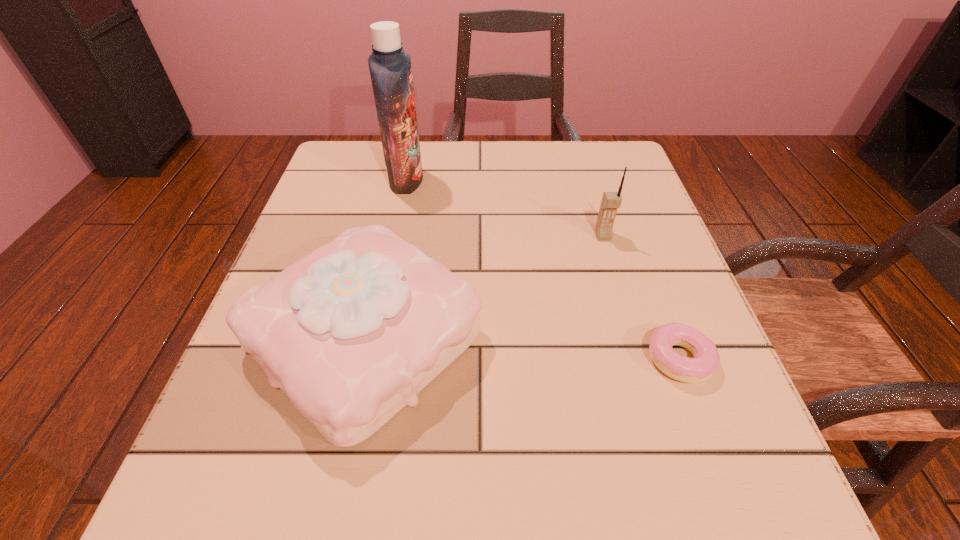
The width and height of the screenshot is (960, 540). Identify the location of the farthest object. (390, 69).

I want to click on the tallest object, so click(x=390, y=69).

This screenshot has height=540, width=960. What are the coordinates of `the third nearest object` in the screenshot? It's located at (611, 201).

Where is `the second tallest object`? the second tallest object is located at coordinates (611, 201).

This screenshot has width=960, height=540. In order to click on cake in this screenshot , I will do `click(351, 333)`.

Identify the location of the shortest object. (706, 360).

Locate an element on the screen. The image size is (960, 540). vacant region located 0.340m on the front label of the farthest object is located at coordinates (574, 180).

This screenshot has width=960, height=540. What are the coordinates of `vacant area situated on the front of the cellular telephone, where the keypad is located` in the screenshot? It's located at (617, 283).

At what (x,y) coordinates should I click in order to perform the action: click on free location located 0.250m on the right of the cake. Please return your answer as a coordinate pair (x, y). The image size is (960, 540). Looking at the image, I should click on (641, 338).

Find the location of a particular element. The width and height of the screenshot is (960, 540). vacant region located 0.320m on the back of the doughnut is located at coordinates (624, 210).